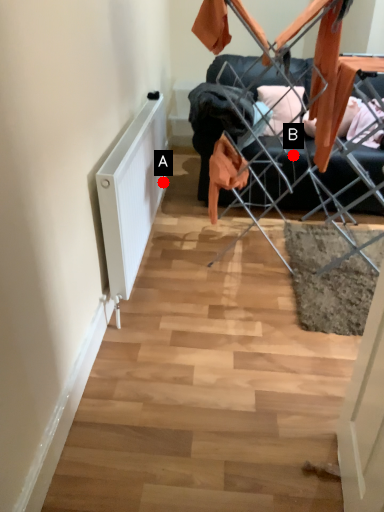
Question: Two points are circled on the image, labeled by A and B beside each circle. Which of the following is the closest to the observer?

Choices:
 (A) A is closer
 (B) B is closer

Answer: (B)